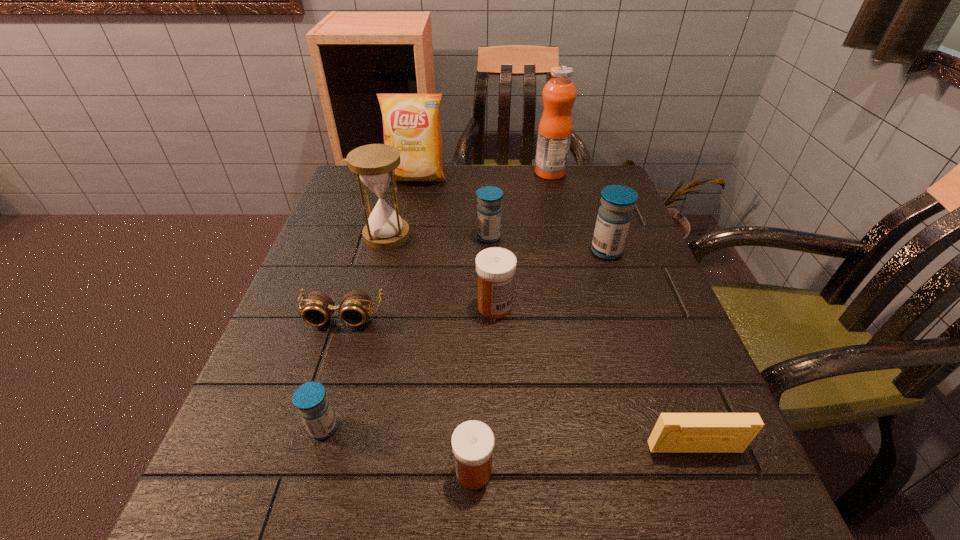
Where is `hourglass located at the left edge`? This screenshot has width=960, height=540. hourglass located at the left edge is located at coordinates (374, 164).

Find the location of a particular element. This screenshot has width=960, height=540. medicine located in the left edge section of the desktop is located at coordinates (310, 398).

This screenshot has height=540, width=960. I want to click on goggles that is at the left edge, so click(x=354, y=308).

Locate an element on the screen. fruit juice at the right edge is located at coordinates (555, 127).

I want to click on medicine situated at the right edge, so click(x=614, y=216).

Find the location of a particular element. Image resolution: width=960 pixels, height=540 pixels. videotape that is at the right edge is located at coordinates (673, 432).

The image size is (960, 540). In order to click on object that is at the far left corner in this screenshot , I will do `click(411, 122)`.

At what (x,y) coordinates should I click in order to perform the action: click on object at the far right corner. Please return your answer as a coordinate pair (x, y). Looking at the image, I should click on [555, 127].

Image resolution: width=960 pixels, height=540 pixels. Find the location of `vacant space at the far edge of the desktop`. vacant space at the far edge of the desktop is located at coordinates (403, 191).

The image size is (960, 540). In the image, there is a desktop. In order to click on vacant space at the left edge in this screenshot , I will do `click(318, 272)`.